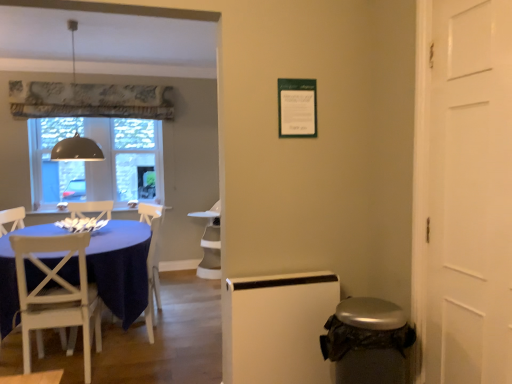
Question: Is white glossy armchair at center, which ranks as the second armchair in front-to-back order, beside white wood chair at left, which ranks as the second armchair in back-to-front order?

Choices:
 (A) yes
 (B) no

Answer: (B)

Question: Can you confirm if white glossy armchair at center, which ranks as the second armchair in front-to-back order, is thinner than white wood chair at left, which ranks as the second armchair in back-to-front order?

Choices:
 (A) yes
 (B) no

Answer: (B)

Question: Does white glossy armchair at center, which ranks as the second armchair in front-to-back order, appear on the right side of white wood chair at left, the 1th armchair viewed from the front?

Choices:
 (A) yes
 (B) no

Answer: (A)

Question: From the image's perspective, would you say white glossy armchair at center, which ranks as the 1th armchair in back-to-front order, is positioned over white wood chair at left, the 1th armchair viewed from the front?

Choices:
 (A) no
 (B) yes

Answer: (B)

Question: Can white wood chair at left, which ranks as the second armchair in back-to-front order, be found inside white glossy armchair at center, which ranks as the second armchair in front-to-back order?

Choices:
 (A) no
 (B) yes

Answer: (A)

Question: Considering the relative sizes of white glossy armchair at center, which ranks as the second armchair in front-to-back order, and white wood chair at left, which ranks as the second armchair in back-to-front order, in the image provided, is white glossy armchair at center, which ranks as the second armchair in front-to-back order, smaller than white wood chair at left, which ranks as the second armchair in back-to-front order,?

Choices:
 (A) no
 (B) yes

Answer: (A)

Question: Is clear glass window at center directly adjacent to white wood chair at left, the 1th armchair viewed from the front?

Choices:
 (A) yes
 (B) no

Answer: (B)

Question: Is clear glass window at center in front of white wood chair at left, the 1th armchair viewed from the front?

Choices:
 (A) yes
 (B) no

Answer: (B)

Question: From a real-world perspective, is clear glass window at center over white wood chair at left, which ranks as the second armchair in back-to-front order?

Choices:
 (A) yes
 (B) no

Answer: (A)

Question: Can we say clear glass window at center lies outside white wood chair at left, the 1th armchair viewed from the front?

Choices:
 (A) no
 (B) yes

Answer: (B)

Question: Would you say white wood chair at left, which ranks as the second armchair in back-to-front order, is part of clear glass window at center's contents?

Choices:
 (A) yes
 (B) no

Answer: (B)

Question: Is clear glass window at center shorter than white wood chair at left, the 1th armchair viewed from the front?

Choices:
 (A) yes
 (B) no

Answer: (B)

Question: Does matte gray dome at upper left have a lesser height compared to clear glass window at center?

Choices:
 (A) yes
 (B) no

Answer: (B)